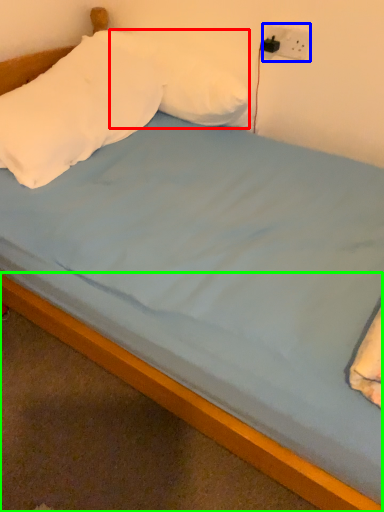
Question: Considering the real-world distances, which object is farthest from pillow (highlighted by a red box)? electric outlet (highlighted by a blue box) or bed frame (highlighted by a green box)?

Choices:
 (A) electric outlet
 (B) bed frame

Answer: (B)